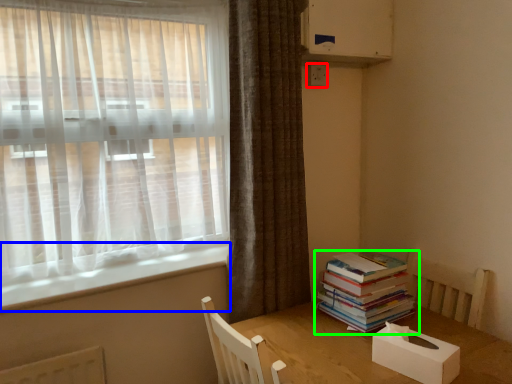
Question: Based on their relative distances, which object is farther from electric outlet (highlighted by a red box)? Choose from window sill (highlighted by a blue box) and book (highlighted by a green box).

Choices:
 (A) window sill
 (B) book

Answer: (A)